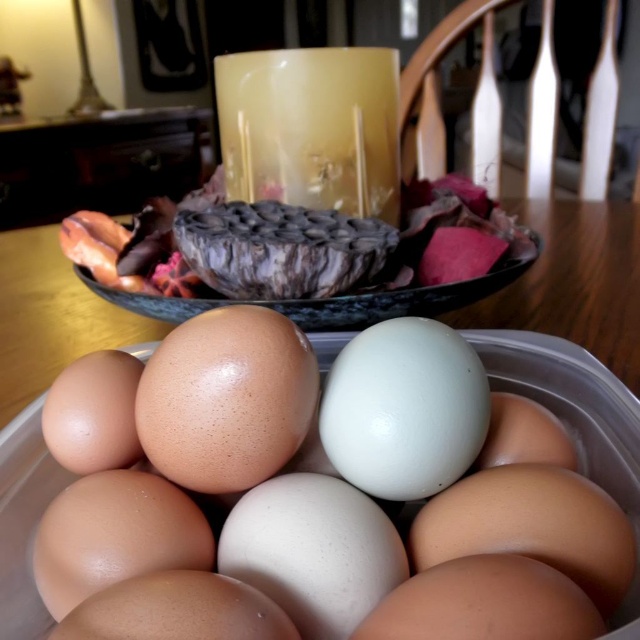
Consider the image. You are holding a small toy that is 12 inches long. You want to place it on the surface where the translucent glass candle at center is located. Is there enough space for the toy to fit without overlapping the candle?

The translucent glass candle at center is 22.66 inches away from the viewer, so the surface it is on is likely large enough to accommodate a 12 inch toy without overlapping. However, since the exact dimensions of the surface are not provided, it is recommended to ensure there is sufficient space around the candle before placing the toy.

You are standing in front of a glass container holding eggs and a decorative bowl with dried flowers. There is a point marked at coordinates (310,128). What object is located at that point?

The point at coordinates (310,128) indicates a translucent glass candle at center.

You are organizing a basket of eggs and notice the brown matte egg at center and the white glossy egg at center. Which egg is sitting on top of the other?

The brown matte egg at center is positioned over the white glossy egg at center, so it is sitting on top.